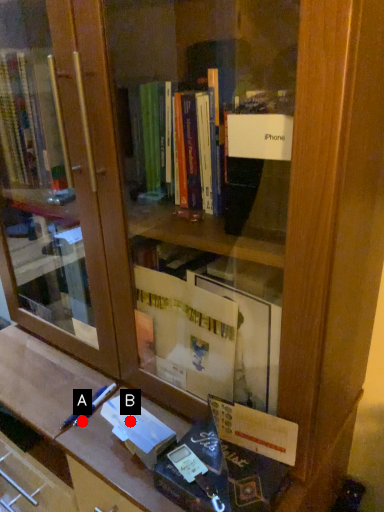
Question: Two points are circled on the image, labeled by A and B beside each circle. Which point is further to the camera?

Choices:
 (A) A is further
 (B) B is further

Answer: (A)